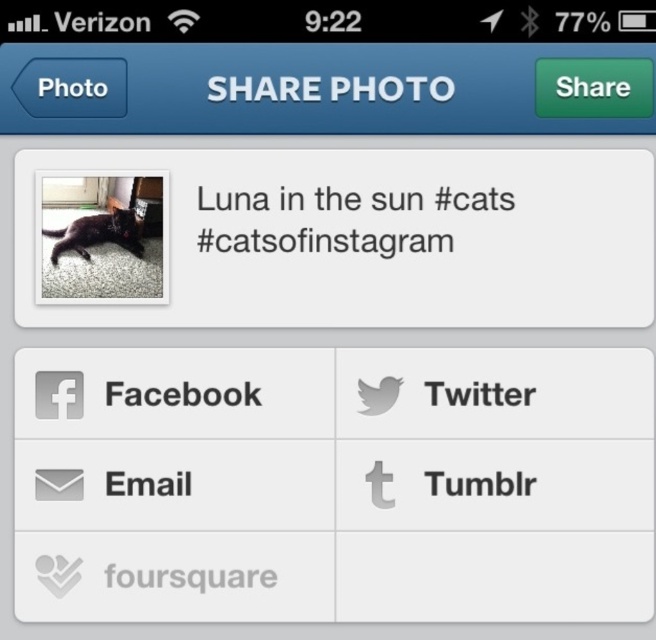
Question: Among these points, which one is nearest to the camera?

Choices:
 (A) (527, 403)
 (B) (180, 481)
 (C) (266, 586)
 (D) (520, 477)

Answer: (C)

Question: Can you confirm if gray matte tumblr at center is smaller than gray matte email at center?

Choices:
 (A) no
 (B) yes

Answer: (A)

Question: Which point is farther to the camera?

Choices:
 (A) black fur cat at center
 (B) gray matte tumblr at center
 (C) black matte cat at upper left

Answer: (A)

Question: Which object is farther from the camera taking this photo?

Choices:
 (A) black matte cat at upper left
 (B) gray matte foursquare at center
 (C) gray matte email at center

Answer: (A)

Question: Can you confirm if gray matte foursquare at center is positioned to the right of gray matte email at center?

Choices:
 (A) no
 (B) yes

Answer: (B)

Question: Considering the relative positions of gray matte twitter at center and gray matte email at center in the image provided, where is gray matte twitter at center located with respect to gray matte email at center?

Choices:
 (A) right
 (B) left

Answer: (A)